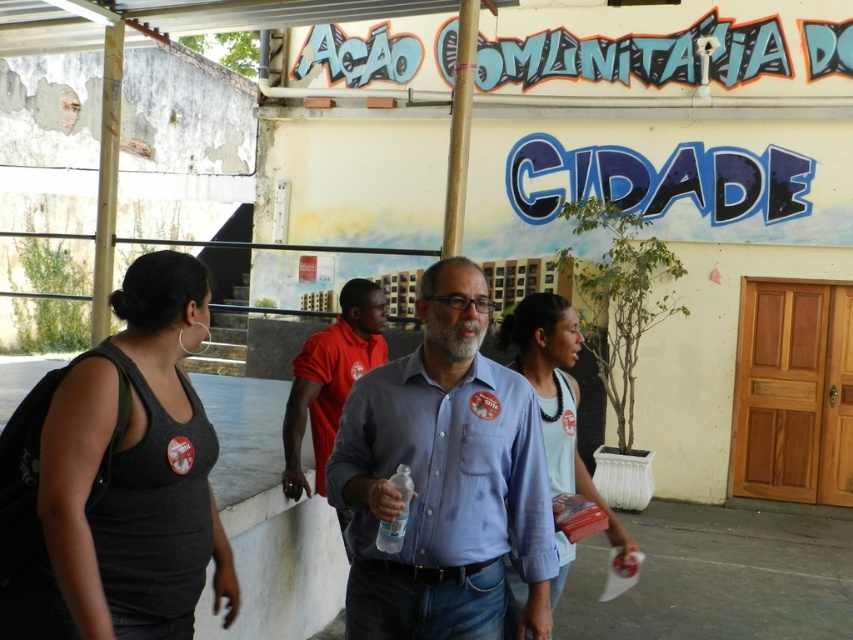
You are organizing a group photo and need to arrange the participants so that the light blue shirt at center and the red cotton shirt at center are both visible. Which shirt should be placed to the side to avoid overlapping?

The light blue shirt at center should be placed to the side because it might be wider than the red cotton shirt at center, reducing the chance of overlap.

You are a photographer trying to capture a group photo of the people in front of the building with the mural. You notice two shirts at the center of the image, a blue cotton shirt at center and a light blue shirt at center. Which shirt should you adjust to ensure both shirts are visible in the frame, considering their height?

The blue cotton shirt at center is shorter than the light blue shirt at center. To ensure both shirts are visible, you should adjust the light blue shirt at center, as it is taller and might be blocking the view of the shorter blue cotton shirt at center.